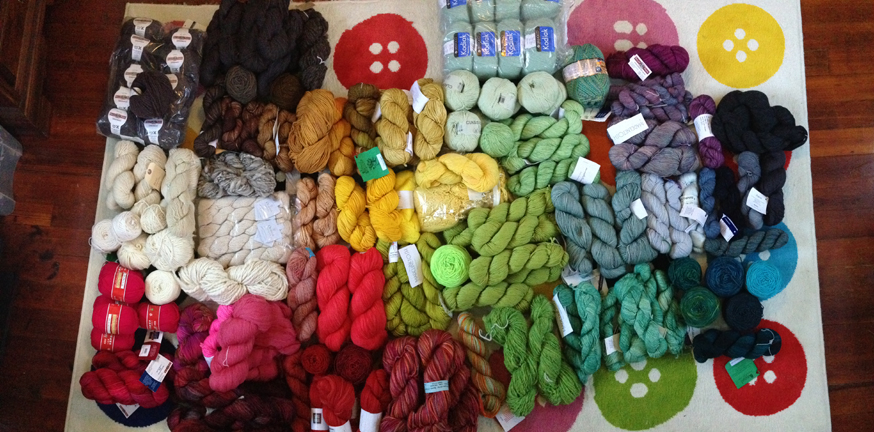
Where is `wooden floor`? wooden floor is located at coordinates (70, 226), (843, 257).